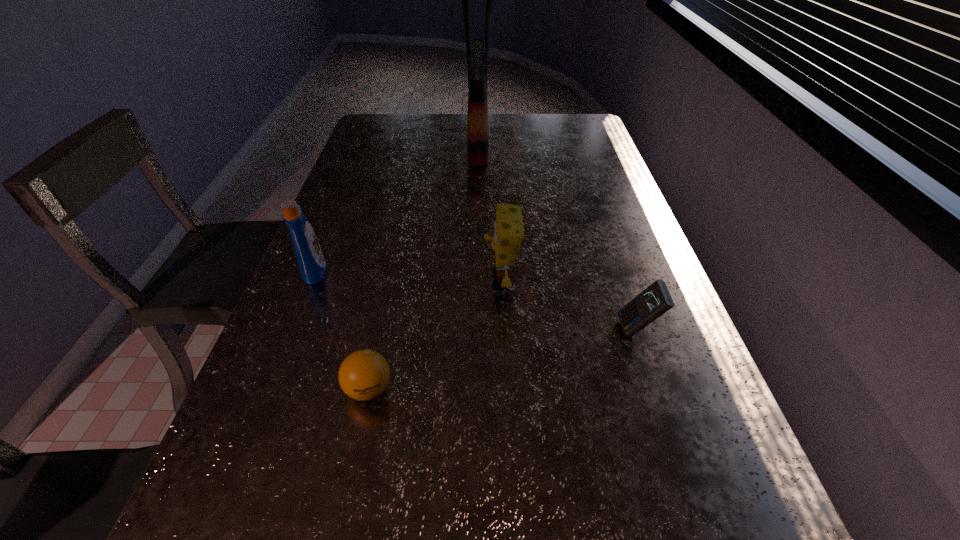
Where is `vacant space located on the label of the leftmost object`? vacant space located on the label of the leftmost object is located at coordinates click(x=444, y=270).

At what (x,y) coordinates should I click in order to perform the action: click on vacant area situated on the face of the third shortest object. Please return your answer as a coordinate pair (x, y). Image resolution: width=960 pixels, height=540 pixels. Looking at the image, I should click on (462, 279).

Locate an element on the screen. vacant region located on the face of the third shortest object is located at coordinates (445, 279).

The height and width of the screenshot is (540, 960). I want to click on free point located 0.270m on the face of the third shortest object, so click(368, 279).

I want to click on free location located 0.130m on the front-facing side of the second nearest object, so click(x=557, y=330).

Image resolution: width=960 pixels, height=540 pixels. In order to click on blank space located on the front-facing side of the second nearest object in this screenshot , I will do `click(581, 330)`.

Identify the location of free region located 0.060m on the front-facing side of the second nearest object. (590, 330).

Locate an element on the screen. vacant space located on the side with brand of the shortest object is located at coordinates (348, 485).

Locate an element on the screen. Image resolution: width=960 pixels, height=540 pixels. object at the far edge is located at coordinates (477, 55).

Find the location of a particular element. The height and width of the screenshot is (540, 960). object located in the left edge section of the desktop is located at coordinates (308, 253).